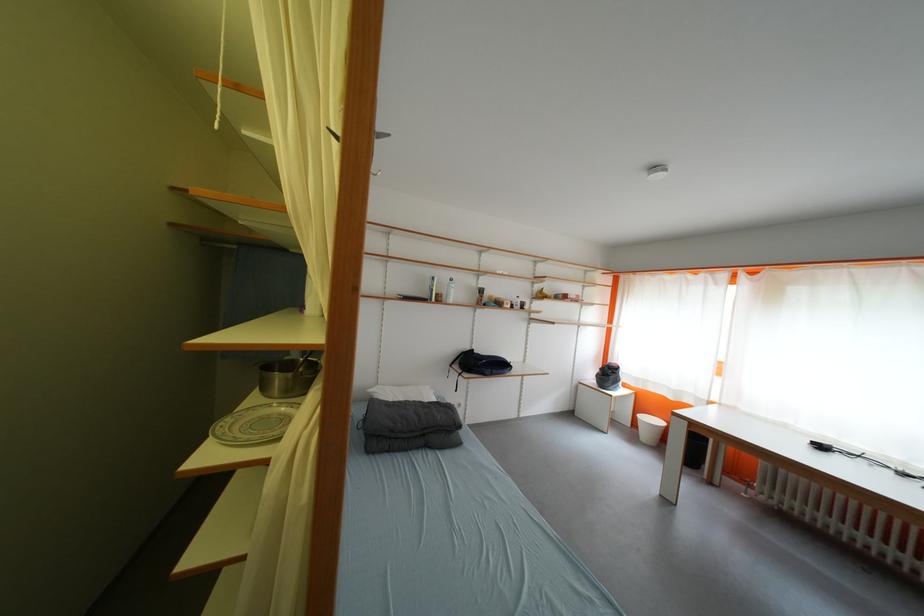
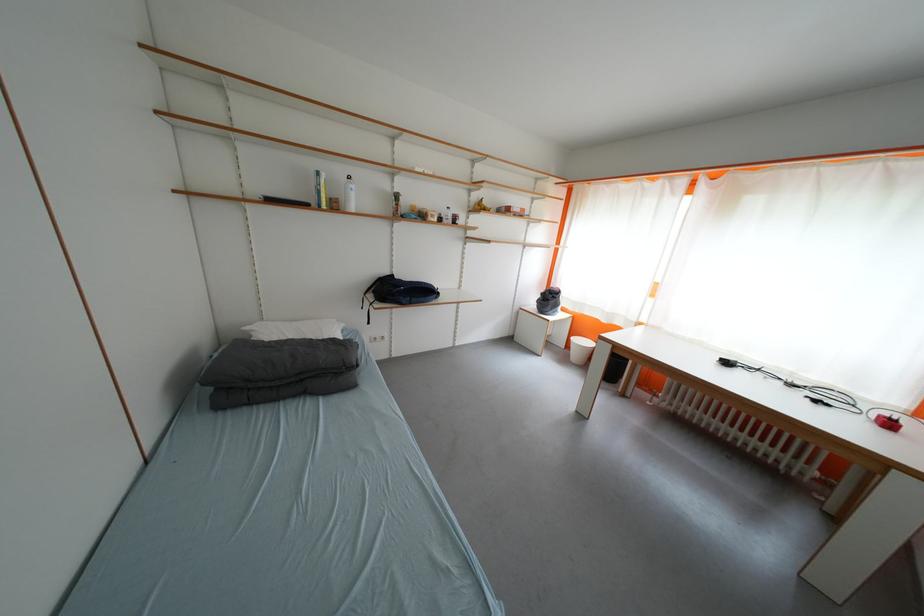
The point at (x=610, y=371) is marked in the first image. Where is the corresponding point in the second image?

(551, 297)